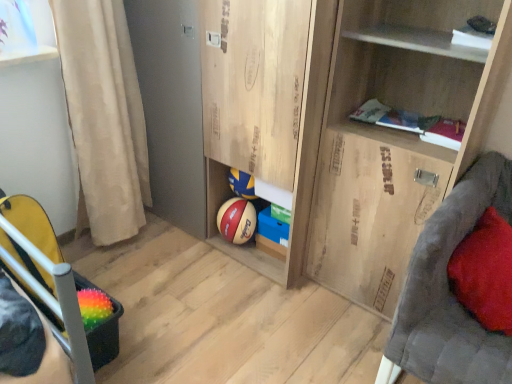
Question: Is rubber textured basketball at lower left to the left of red velvet pillow at right from the viewer's perspective?

Choices:
 (A) yes
 (B) no

Answer: (A)

Question: Is rubber textured basketball at lower left at the right side of red velvet pillow at right?

Choices:
 (A) yes
 (B) no

Answer: (B)

Question: Can we say rubber textured basketball at lower left lies outside red velvet pillow at right?

Choices:
 (A) no
 (B) yes

Answer: (B)

Question: Is rubber textured basketball at lower left wider than red velvet pillow at right?

Choices:
 (A) no
 (B) yes

Answer: (A)

Question: From a real-world perspective, is rubber textured basketball at lower left beneath red velvet pillow at right?

Choices:
 (A) no
 (B) yes

Answer: (B)

Question: Is rubber textured basketball at lower left surrounding red velvet pillow at right?

Choices:
 (A) no
 (B) yes

Answer: (A)

Question: Does wooden cabinet at lower center appear on the left side of beige fabric curtain at left?

Choices:
 (A) no
 (B) yes

Answer: (A)

Question: Are wooden cabinet at lower center and beige fabric curtain at left making contact?

Choices:
 (A) yes
 (B) no

Answer: (B)

Question: Is wooden cabinet at lower center far away from beige fabric curtain at left?

Choices:
 (A) yes
 (B) no

Answer: (B)

Question: From a real-world perspective, is wooden cabinet at lower center on top of beige fabric curtain at left?

Choices:
 (A) yes
 (B) no

Answer: (A)

Question: Can you confirm if wooden cabinet at lower center is thinner than beige fabric curtain at left?

Choices:
 (A) yes
 (B) no

Answer: (B)

Question: Considering the relative sizes of wooden cabinet at lower center and beige fabric curtain at left in the image provided, is wooden cabinet at lower center bigger than beige fabric curtain at left?

Choices:
 (A) yes
 (B) no

Answer: (A)

Question: Is beige fabric curtain at left smaller than rubber textured basketball at lower left?

Choices:
 (A) no
 (B) yes

Answer: (A)